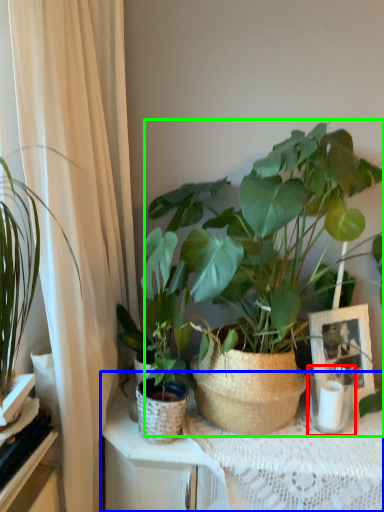
Question: Which object is positioned closest to candle holder (highlighted by a red box)? Select from table (highlighted by a blue box) and houseplant (highlighted by a green box).

Choices:
 (A) table
 (B) houseplant

Answer: (A)